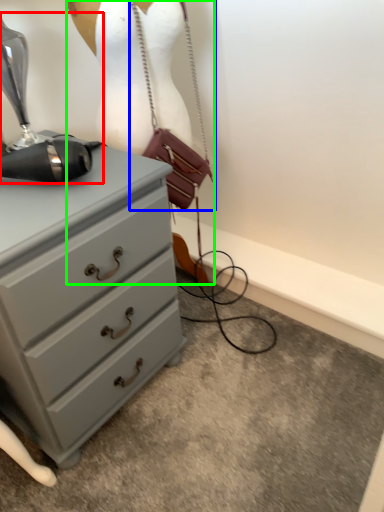
Question: Which object is positioned farthest from sewing machine (highlighted by a red box)? Select from handbag (highlighted by a blue box) and mannequin (highlighted by a green box).

Choices:
 (A) handbag
 (B) mannequin

Answer: (A)